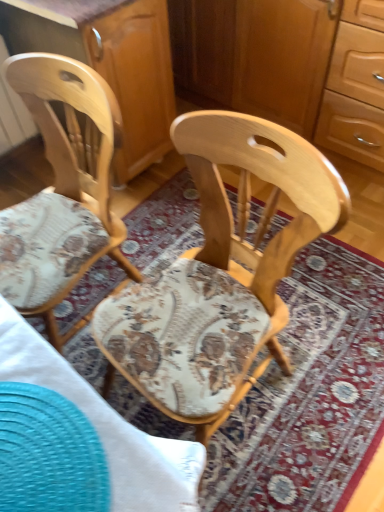
Looking at this image, what is the approximate height of wooden dresser at center?

30.92 inches.

The height and width of the screenshot is (512, 384). In order to click on wooden dresser at center in this screenshot , I will do `click(257, 56)`.

At what (x,y) coordinates should I click in order to perform the action: click on wooden cabinet at center. Please return your answer as a coordinate pair (x, y). This screenshot has height=512, width=384. Looking at the image, I should click on (109, 61).

Identify the location of natural wood chair at left, placed as the second chair when sorted from right to left. (62, 190).

You are a GUI agent. You are given a task and a screenshot of the screen. Output one action in this format:
    pyautogui.click(x=<x>, y=<y>)
    Task: Click on the natural wood chair at center, which appears as the 2th chair when viewed from the left
    
    Given the screenshot: What is the action you would take?
    pyautogui.click(x=220, y=274)

Is smooth teal placemat at lower left directly adjacent to natural wood chair at center, which appears as the 2th chair when viewed from the left?

smooth teal placemat at lower left and natural wood chair at center, which appears as the 2th chair when viewed from the left, are clearly separated.

Is smooth teal placemat at lower left facing away from natural wood chair at center, which appears as the 2th chair when viewed from the left?

smooth teal placemat at lower left is not turned away from natural wood chair at center, which appears as the 2th chair when viewed from the left.

Is point (140, 461) less distant than point (244, 175)?

Yes, it is.

Does smooth teal placemat at lower left have a smaller size compared to natural wood chair at center, which is counted as the 1th chair, starting from the right?

Indeed, smooth teal placemat at lower left has a smaller size compared to natural wood chair at center, which is counted as the 1th chair, starting from the right.

Is smooth teal placemat at lower left oriented towards wooden cabinet at center?

No, smooth teal placemat at lower left is not oriented towards wooden cabinet at center.

Find the location of a particular element. The height and width of the screenshot is (512, 384). cabinetry behind the smooth teal placemat at lower left is located at coordinates (109, 61).

From a real-world perspective, which object rests below the other?

wooden cabinet at center.

Considering the positions of objects smooth teal placemat at lower left and wooden cabinet at center in the image provided, who is more to the right, smooth teal placemat at lower left or wooden cabinet at center?

Positioned to the right is smooth teal placemat at lower left.

Is the surface of smooth teal placemat at lower left in direct contact with natural wood chair at left, placed as the second chair when sorted from right to left?

No, smooth teal placemat at lower left is not beside natural wood chair at left, placed as the second chair when sorted from right to left.

The height and width of the screenshot is (512, 384). I want to click on table on the right of natural wood chair at left, arranged as the 1th chair when viewed from the left, so click(x=78, y=439).

Is smooth teal placemat at lower left inside the boundaries of natural wood chair at left, placed as the second chair when sorted from right to left, or outside?

smooth teal placemat at lower left is located beyond the bounds of natural wood chair at left, placed as the second chair when sorted from right to left.

Between natural wood chair at center, which appears as the 2th chair when viewed from the left, and wooden dresser at center, which one appears on the right side from the viewer's perspective?

wooden dresser at center.

Is natural wood chair at center, which appears as the 2th chair when viewed from the left, wider or thinner than wooden dresser at center?

natural wood chair at center, which appears as the 2th chair when viewed from the left, is thinner than wooden dresser at center.

Measure the distance between natural wood chair at center, which appears as the 2th chair when viewed from the left, and wooden dresser at center.

The distance of natural wood chair at center, which appears as the 2th chair when viewed from the left, from wooden dresser at center is 1.03 meters.

From the image's perspective, which is above, natural wood chair at center, which appears as the 2th chair when viewed from the left, or wooden dresser at center?

wooden dresser at center.

From the image's perspective, would you say natural wood chair at left, placed as the second chair when sorted from right to left, is shown under smooth teal placemat at lower left?

Incorrect, from the image's perspective, natural wood chair at left, placed as the second chair when sorted from right to left, is higher than smooth teal placemat at lower left.

How different are the orientations of natural wood chair at left, placed as the second chair when sorted from right to left, and smooth teal placemat at lower left in degrees?

natural wood chair at left, placed as the second chair when sorted from right to left, and smooth teal placemat at lower left are facing 85.8 degrees away from each other.

From a real-world perspective, relative to smooth teal placemat at lower left, is natural wood chair at left, arranged as the 1th chair when viewed from the left, vertically above or below?

Clearly, from a real-world perspective, natural wood chair at left, arranged as the 1th chair when viewed from the left, is below smooth teal placemat at lower left.

Considering the positions of objects wooden dresser at center and wooden cabinet at center in the image provided, who is behind, wooden dresser at center or wooden cabinet at center?

wooden dresser at center is behind.

Is wooden dresser at center wider or thinner than wooden cabinet at center?

In the image, wooden dresser at center appears to be wider than wooden cabinet at center.

Is point (262, 19) farther from camera compared to point (133, 144)?

No.

How different are the orientations of wooden dresser at center and wooden cabinet at center in degrees?

91.2 degrees.

From a real-world perspective, does natural wood chair at center, which is counted as the 1th chair, starting from the right, sit lower than natural wood chair at left, placed as the second chair when sorted from right to left?

Yes, from a real-world perspective, natural wood chair at center, which is counted as the 1th chair, starting from the right, is beneath natural wood chair at left, placed as the second chair when sorted from right to left.

Considering the relative positions of natural wood chair at center, which is counted as the 1th chair, starting from the right, and natural wood chair at left, placed as the second chair when sorted from right to left, in the image provided, is natural wood chair at center, which is counted as the 1th chair, starting from the right, to the right of natural wood chair at left, placed as the second chair when sorted from right to left, from the viewer's perspective?

Yes.

Is natural wood chair at center, which is counted as the 1th chair, starting from the right, taller or shorter than natural wood chair at left, arranged as the 1th chair when viewed from the left?

natural wood chair at center, which is counted as the 1th chair, starting from the right, is taller than natural wood chair at left, arranged as the 1th chair when viewed from the left.

Does point (181, 283) lie in front of point (5, 258)?

Yes, point (181, 283) is closer to viewer.

From the image's perspective, starting from the smooth teal placemat at lower left, which chair is the 1st one above? Please provide its 2D coordinates.

[(220, 274)]

This screenshot has height=512, width=384. Identify the location of table that appears above the wooden cabinet at center (from a real-world perspective). (78, 439).

Considering their positions, is wooden cabinet at center positioned further to natural wood chair at center, which appears as the 2th chair when viewed from the left, than smooth teal placemat at lower left?

wooden cabinet at center lies further to natural wood chair at center, which appears as the 2th chair when viewed from the left, than the other object.

When comparing their distances from smooth teal placemat at lower left, does natural wood chair at left, arranged as the 1th chair when viewed from the left, or natural wood chair at center, which appears as the 2th chair when viewed from the left, seem further?

The object further to smooth teal placemat at lower left is natural wood chair at left, arranged as the 1th chair when viewed from the left.

Estimate the real-world distances between objects in this image. Which object is further from natural wood chair at center, which appears as the 2th chair when viewed from the left, smooth teal placemat at lower left or wooden dresser at center?

wooden dresser at center is positioned further to the anchor natural wood chair at center, which appears as the 2th chair when viewed from the left.

Which object lies further to the anchor point wooden cabinet at center, smooth teal placemat at lower left or natural wood chair at center, which is counted as the 1th chair, starting from the right?

smooth teal placemat at lower left is further to wooden cabinet at center.

Based on their spatial positions, is smooth teal placemat at lower left or natural wood chair at center, which appears as the 2th chair when viewed from the left, closer to natural wood chair at left, placed as the second chair when sorted from right to left?

natural wood chair at center, which appears as the 2th chair when viewed from the left, lies closer to natural wood chair at left, placed as the second chair when sorted from right to left, than the other object.

Based on their spatial positions, is natural wood chair at center, which is counted as the 1th chair, starting from the right, or natural wood chair at left, arranged as the 1th chair when viewed from the left, further from smooth teal placemat at lower left?

The object further to smooth teal placemat at lower left is natural wood chair at left, arranged as the 1th chair when viewed from the left.

Which object lies further to the anchor point smooth teal placemat at lower left, natural wood chair at center, which is counted as the 1th chair, starting from the right, or wooden dresser at center?

wooden dresser at center is positioned further to the anchor smooth teal placemat at lower left.

Considering their positions, is natural wood chair at left, placed as the second chair when sorted from right to left, positioned further to wooden cabinet at center than natural wood chair at center, which is counted as the 1th chair, starting from the right?

natural wood chair at center, which is counted as the 1th chair, starting from the right, lies further to wooden cabinet at center than the other object.

Where is `chair between wooden dresser at center and natural wood chair at center, which is counted as the 1th chair, starting from the right, in the up-down direction`? The width and height of the screenshot is (384, 512). chair between wooden dresser at center and natural wood chair at center, which is counted as the 1th chair, starting from the right, in the up-down direction is located at coordinates (62, 190).

The height and width of the screenshot is (512, 384). Find the location of `chair between wooden cabinet at center and natural wood chair at center, which is counted as the 1th chair, starting from the right, in the up-down direction`. chair between wooden cabinet at center and natural wood chair at center, which is counted as the 1th chair, starting from the right, in the up-down direction is located at coordinates (62, 190).

At what (x,y) coordinates should I click in order to perform the action: click on cabinetry between wooden dresser at center and natural wood chair at center, which appears as the 2th chair when viewed from the left, in the up-down direction. Please return your answer as a coordinate pair (x, y). Image resolution: width=384 pixels, height=512 pixels. Looking at the image, I should click on (109, 61).

Where is `table between natural wood chair at left, placed as the second chair when sorted from right to left, and natural wood chair at center, which appears as the 2th chair when viewed from the left, from left to right`? table between natural wood chair at left, placed as the second chair when sorted from right to left, and natural wood chair at center, which appears as the 2th chair when viewed from the left, from left to right is located at coordinates (78, 439).